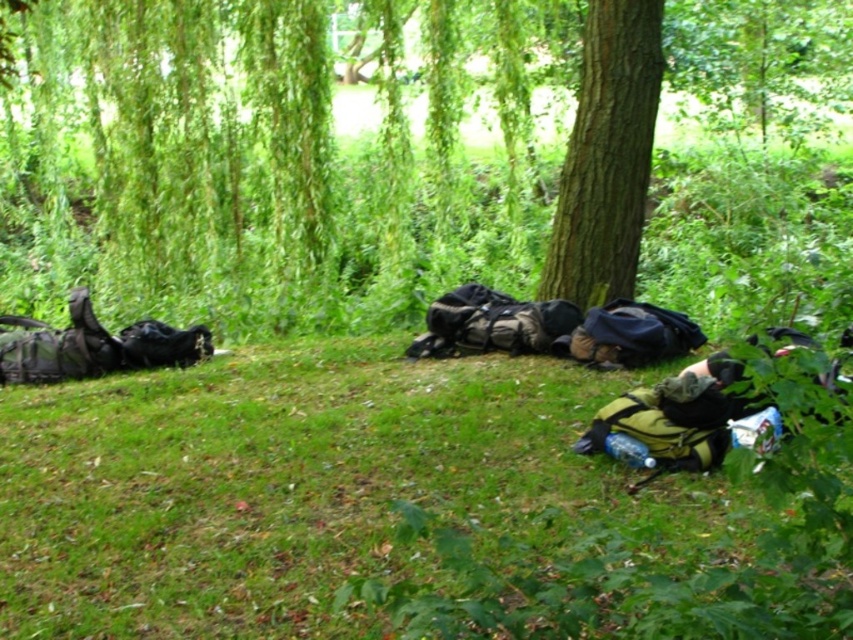
Question: Which object appears farthest from the camera in this image?

Choices:
 (A) brown rough bark tree at center
 (B) green grass at lower left

Answer: (A)

Question: Is green grass at lower left to the left of brown rough bark tree at center from the viewer's perspective?

Choices:
 (A) yes
 (B) no

Answer: (A)

Question: Is green grass at lower left bigger than brown rough bark tree at center?

Choices:
 (A) yes
 (B) no

Answer: (A)

Question: Which of the following is the farthest from the observer?

Choices:
 (A) (613, 92)
 (B) (434, 550)

Answer: (A)

Question: Does green grass at lower left lie behind brown rough bark tree at center?

Choices:
 (A) yes
 (B) no

Answer: (B)

Question: Which of the following is the farthest from the observer?

Choices:
 (A) (54, 406)
 (B) (573, 301)

Answer: (B)